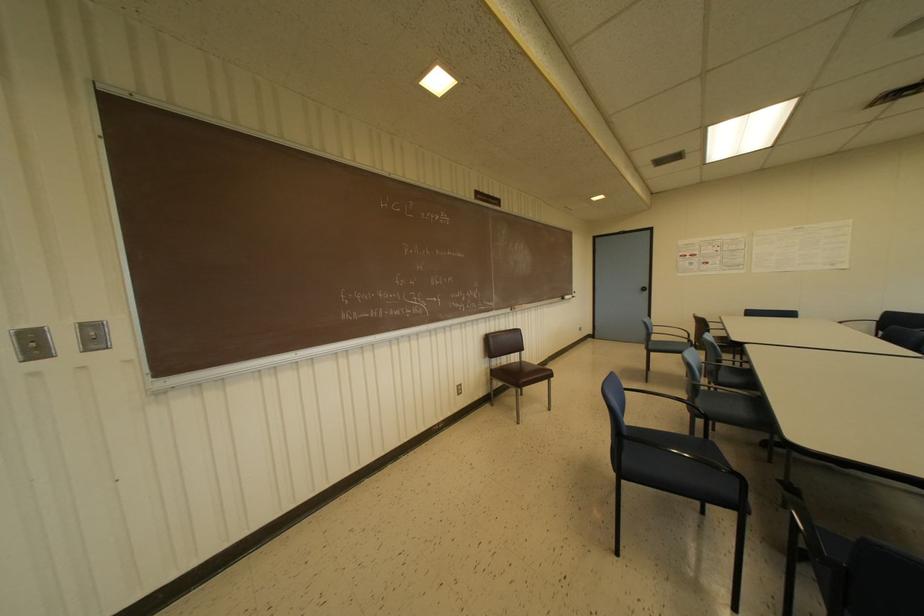
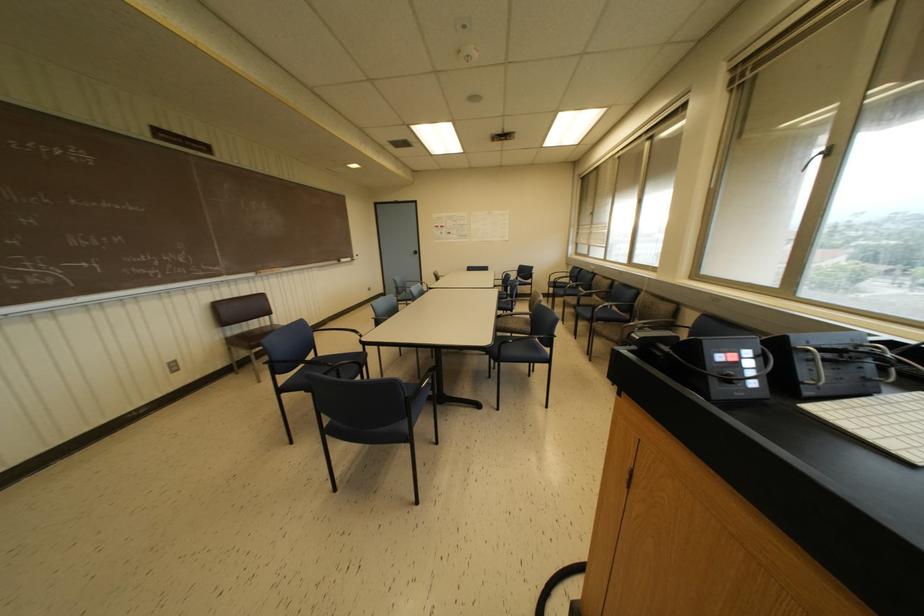
The point at (565, 296) is marked in the first image. Where is the corresponding point in the second image?

(342, 259)